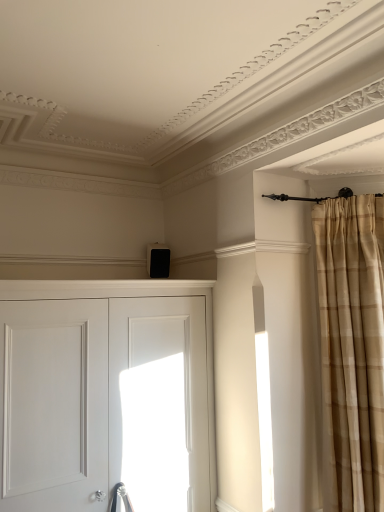
Question: Which is correct: beige plaid curtain at right is inside white matte door at center, or outside of it?

Choices:
 (A) outside
 (B) inside

Answer: (A)

Question: From the image's perspective, is beige plaid curtain at right positioned above or below white matte door at center?

Choices:
 (A) above
 (B) below

Answer: (A)

Question: Is beige plaid curtain at right in front of or behind white matte door at center in the image?

Choices:
 (A) front
 (B) behind

Answer: (B)

Question: Is white matte door at center situated inside beige plaid curtain at right or outside?

Choices:
 (A) inside
 (B) outside

Answer: (B)

Question: Considering the positions of white matte door at center and beige plaid curtain at right in the image, is white matte door at center taller or shorter than beige plaid curtain at right?

Choices:
 (A) tall
 (B) short

Answer: (B)

Question: Does point (206, 370) appear closer or farther from the camera than point (340, 408)?

Choices:
 (A) closer
 (B) farther

Answer: (B)

Question: Considering the positions of white matte door at center and beige plaid curtain at right in the image, is white matte door at center wider or thinner than beige plaid curtain at right?

Choices:
 (A) thin
 (B) wide

Answer: (B)